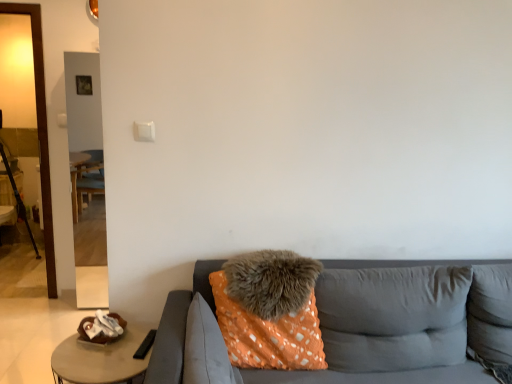
What are the coordinates of `free spot above wooden round table at lower left (from a real-world perspective)` in the screenshot? It's located at pyautogui.click(x=103, y=354).